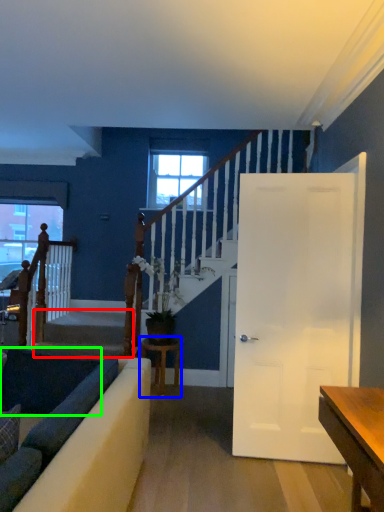
Question: Based on their relative distances, which object is farther from stairwell (highlighted by a red box)? Choose from table (highlighted by a blue box) and dark (highlighted by a green box).

Choices:
 (A) table
 (B) dark

Answer: (B)